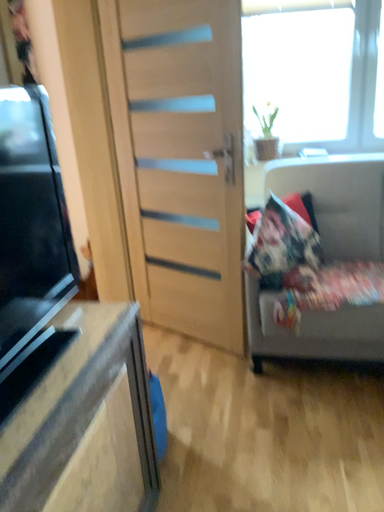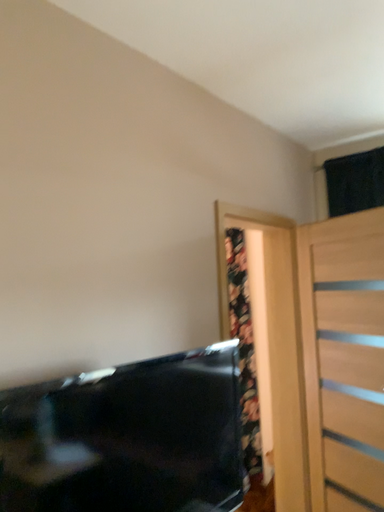
Question: Which way did the camera rotate in the video?

Choices:
 (A) rotated downward
 (B) rotated upward

Answer: (B)